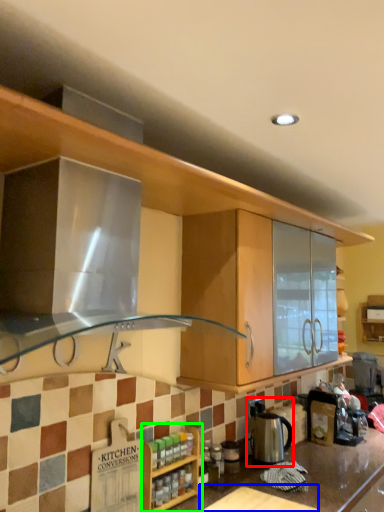
Question: Which object is the closest to the appliance (highlighted by a red box)? Choose among these: table (highlighted by a blue box) or cabinetry (highlighted by a green box).

Choices:
 (A) table
 (B) cabinetry

Answer: (A)